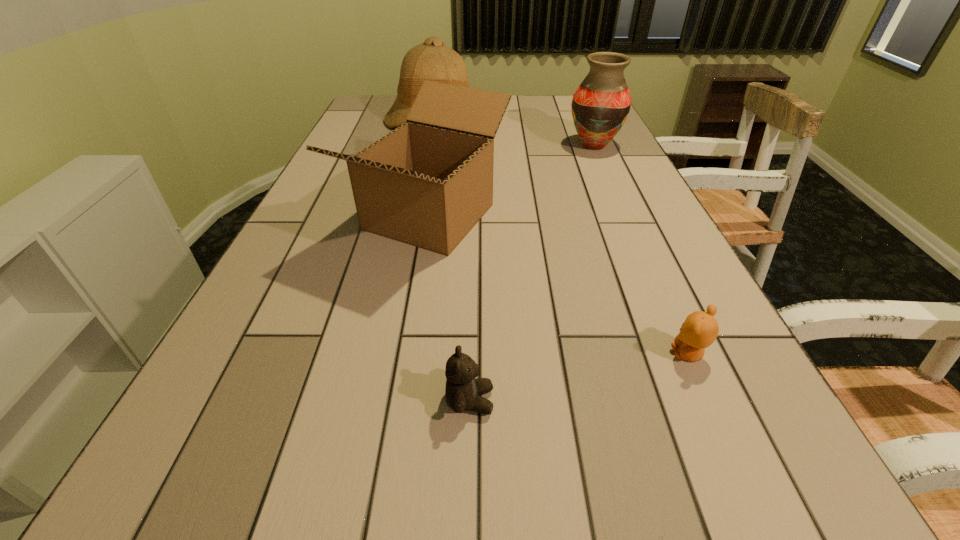
The image size is (960, 540). Identify the location of vacant space that is in between the box and the farther teddy bear. 559,286.

This screenshot has width=960, height=540. I want to click on vacant space in between the vase and the nearest object, so click(532, 273).

Locate an element on the screen. vacant space that is in between the third farthest object and the nearest object is located at coordinates (449, 309).

You are a GUI agent. You are given a task and a screenshot of the screen. Output one action in this format:
    pyautogui.click(x=<x>, y=<y>)
    Task: Click on the unoccupied position between the vase and the hat
    
    Given the screenshot: What is the action you would take?
    513,133

The width and height of the screenshot is (960, 540). I want to click on free point between the vase and the box, so click(512, 181).

Choose which object is the fourth nearest neighbor to the third nearest object. Please provide its 2D coordinates. Your answer should be formatted as a tuple, i.e. [(x, y)], where the tuple contains the x and y coordinates of a point satisfying the conditions above.

[(700, 329)]

Choose which object is the second nearest neighbor to the nearest object. Please provide its 2D coordinates. Your answer should be formatted as a tuple, i.e. [(x, y)], where the tuple contains the x and y coordinates of a point satisfying the conditions above.

[(700, 329)]